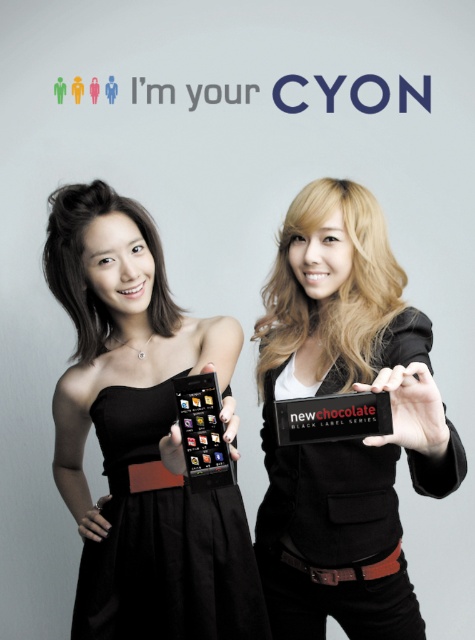
What are the coordinates of the black satin dress at center?

The black satin dress at center is located at coordinates point (162, 541).